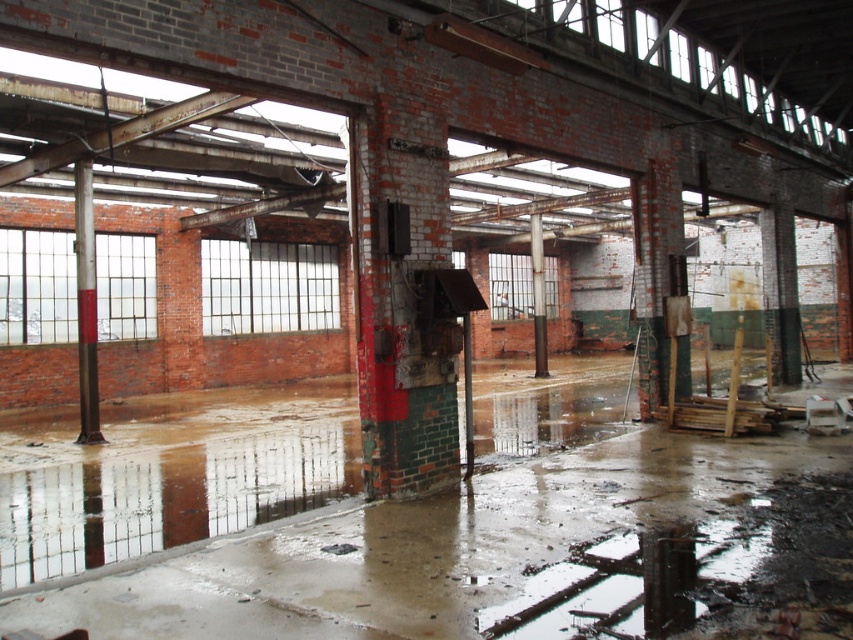
Question: Is rusty metal pillar at center in front of red painted steel pole at left?

Choices:
 (A) yes
 (B) no

Answer: (A)

Question: Which object is positioned closest to the rusty metal pillar at center?

Choices:
 (A) red painted steel pole at left
 (B) brown wood pillar at center

Answer: (A)

Question: Estimate the real-world distances between objects in this image. Which object is closer to the red painted steel pole at left?

Choices:
 (A) rusty metal pillar at center
 (B) brown wood pillar at center

Answer: (A)

Question: Is rusty metal pillar at center to the left of red painted steel pole at left from the viewer's perspective?

Choices:
 (A) yes
 (B) no

Answer: (B)

Question: Which point is farther to the camera?

Choices:
 (A) red painted steel pole at left
 (B) rusty metal pillar at center
 (C) brown wood pillar at center

Answer: (C)

Question: Does red painted steel pole at left appear under brown wood pillar at center?

Choices:
 (A) yes
 (B) no

Answer: (A)